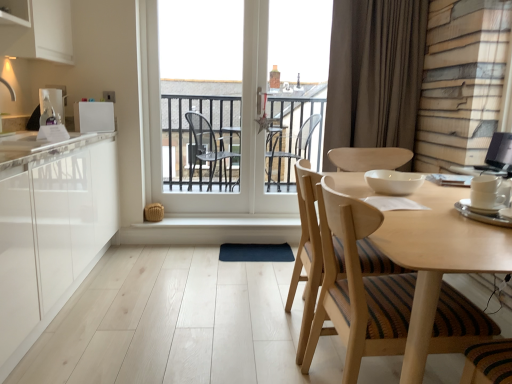
Question: Is white glossy countertop at left to the left of white glossy refrigerator at upper left, placed as the second appliance when sorted from left to right, from the viewer's perspective?

Choices:
 (A) yes
 (B) no

Answer: (A)

Question: Is white glossy countertop at left to the right of white glossy refrigerator at upper left, positioned as the fourth appliance in front-to-back order, from the viewer's perspective?

Choices:
 (A) no
 (B) yes

Answer: (A)

Question: Does white glossy countertop at left have a smaller size compared to white glossy refrigerator at upper left, placed as the second appliance when sorted from left to right?

Choices:
 (A) yes
 (B) no

Answer: (B)

Question: From the image's perspective, is white glossy countertop at left located above white glossy refrigerator at upper left, placed as the second appliance when sorted from left to right?

Choices:
 (A) yes
 (B) no

Answer: (B)

Question: Considering the relative sizes of white glossy countertop at left and white glossy refrigerator at upper left, the second appliance viewed from the back, in the image provided, is white glossy countertop at left thinner than white glossy refrigerator at upper left, the second appliance viewed from the back,?

Choices:
 (A) no
 (B) yes

Answer: (A)

Question: Considering the positions of matte white soap dispenser at left, the 5th appliance from the front, and white glass door at center in the image, is matte white soap dispenser at left, the 5th appliance from the front, bigger or smaller than white glass door at center?

Choices:
 (A) big
 (B) small

Answer: (B)

Question: In terms of width, does matte white soap dispenser at left, which is counted as the 1th appliance, starting from the left, look wider or thinner when compared to white glass door at center?

Choices:
 (A) thin
 (B) wide

Answer: (B)

Question: Is point (47, 89) closer or farther from the camera than point (203, 165)?

Choices:
 (A) closer
 (B) farther

Answer: (A)

Question: From a real-world perspective, relative to white glass door at center, is matte white soap dispenser at left, which ranks as the fifth appliance in right-to-left order, vertically above or below?

Choices:
 (A) below
 (B) above

Answer: (A)

Question: Is point coord(456,190) closer or farther from the camera than point coord(305,61)?

Choices:
 (A) closer
 (B) farther

Answer: (A)

Question: Choose the correct answer: Is light wood round table at center inside white glass door at center or outside it?

Choices:
 (A) outside
 (B) inside

Answer: (A)

Question: From the image's perspective, is light wood round table at center positioned above or below white glass door at center?

Choices:
 (A) below
 (B) above

Answer: (A)

Question: In the image, is light wood round table at center positioned in front of or behind white glass door at center?

Choices:
 (A) front
 (B) behind

Answer: (A)

Question: From a real-world perspective, is brown fabric curtain at upper right positioned above or below white glossy countertop at left?

Choices:
 (A) above
 (B) below

Answer: (A)

Question: Is brown fabric curtain at upper right situated inside white glossy countertop at left or outside?

Choices:
 (A) inside
 (B) outside

Answer: (B)